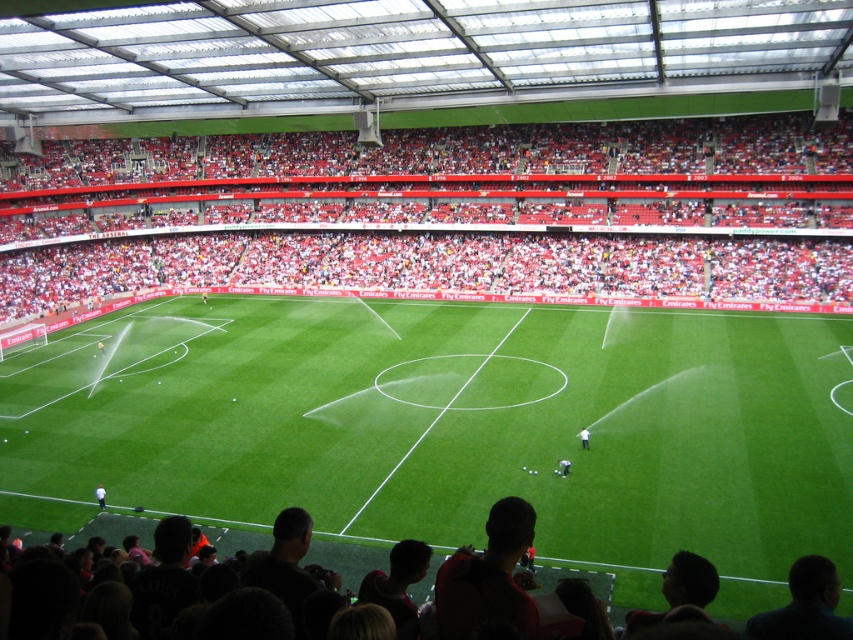
You are a photographer standing at the edge of the field. You want to take a photo of the white matte person at center without the red plastic seats at upper center blocking the view. Is this possible?

The red plastic seats at upper center are much taller than the white matte person at center, so they would block the view of the white matte person at center. You might need to move to a lower position or angle your camera to avoid the seats.

You are a photographer trying to capture a wide shot of the green grass football field at center and the red plastic seats at upper center. Based on their positions, which object should you position your camera closer to in order to include both in the frame without zooming?

The green grass football field at center is to the right of the red plastic seats at upper center. To include both in the frame without zooming, you should position your camera closer to the red plastic seats at upper center so that the green grass football field at center is on the right side of the frame.

You are standing at the center of the field in the football stadium and see two points marked on the roof. Which point is closer to you? The points are labeled as point [735,467] and point [656,224].

Point [735,467] is closer to the viewer than point [656,224].